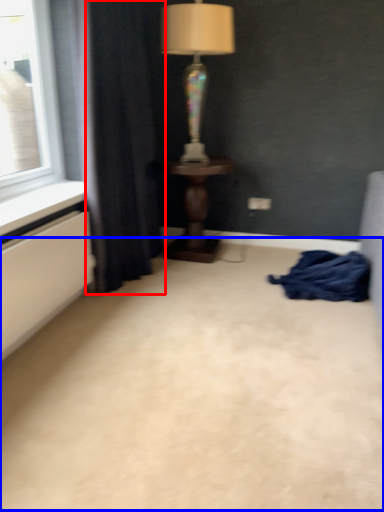
Question: Which point is closer to the camera, curtain (highlighted by a red box) or plain (highlighted by a blue box)?

Choices:
 (A) curtain
 (B) plain

Answer: (B)